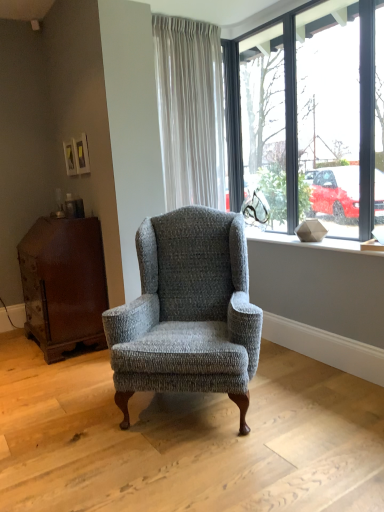
Where is `vacant area on top of white textured curtain at upper center (from a real-world perspective)`? vacant area on top of white textured curtain at upper center (from a real-world perspective) is located at coordinates click(x=185, y=17).